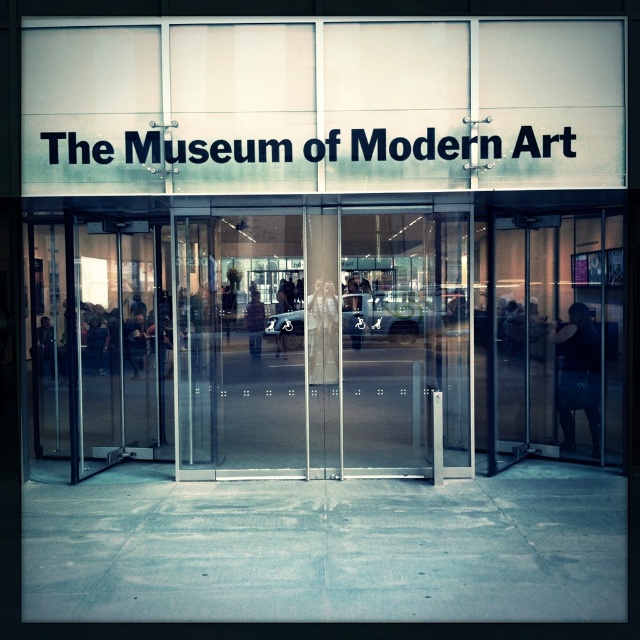
Between black fabric at right and dark brown leather jacket at center, which one appears on the right side from the viewer's perspective?

From the viewer's perspective, black fabric at right appears more on the right side.

Is black fabric at right behind dark brown leather jacket at center?

Yes, black fabric at right is further from the viewer.

Locate an element on the screen. The width and height of the screenshot is (640, 640). black fabric at right is located at coordinates pos(577,376).

Is transparent glass doors at center positioned at the back of dark brown leather jacket at center?

Yes, it is.

Between transparent glass doors at center and dark brown leather jacket at center, which one has more height?

transparent glass doors at center is taller.

Which is behind, point (365, 474) or point (259, 307)?

The point (259, 307) is behind.

You are a GUI agent. You are given a task and a screenshot of the screen. Output one action in this format:
    pyautogui.click(x=<x>, y=<y>)
    Task: Click on the transparent glass doors at center
    The width and height of the screenshot is (640, 640).
    Given the screenshot: What is the action you would take?
    pyautogui.click(x=317, y=339)

Is point (422, 424) farther from camera compared to point (592, 456)?

No, (422, 424) is in front of (592, 456).

Between transparent glass doors at center and black fabric at right, which one is positioned higher?

transparent glass doors at center is above.

Is point (275, 339) in front of point (566, 328)?

Yes, point (275, 339) is closer to viewer.

At what (x,y) coordinates should I click in order to perform the action: click on transparent glass doors at center. Please return your answer as a coordinate pair (x, y). This screenshot has height=640, width=640. Looking at the image, I should click on (317, 339).